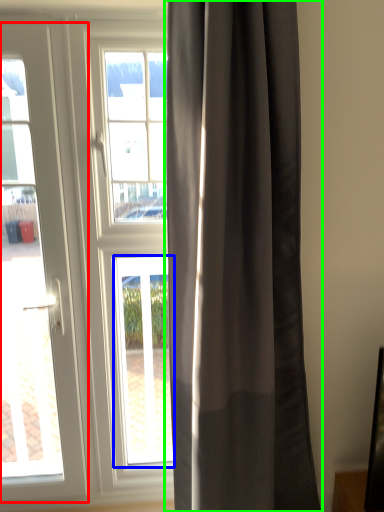
Question: Considering the real-world distances, which object is closest to door (highlighted by a red box)? window (highlighted by a blue box) or curtain (highlighted by a green box).

Choices:
 (A) window
 (B) curtain

Answer: (A)